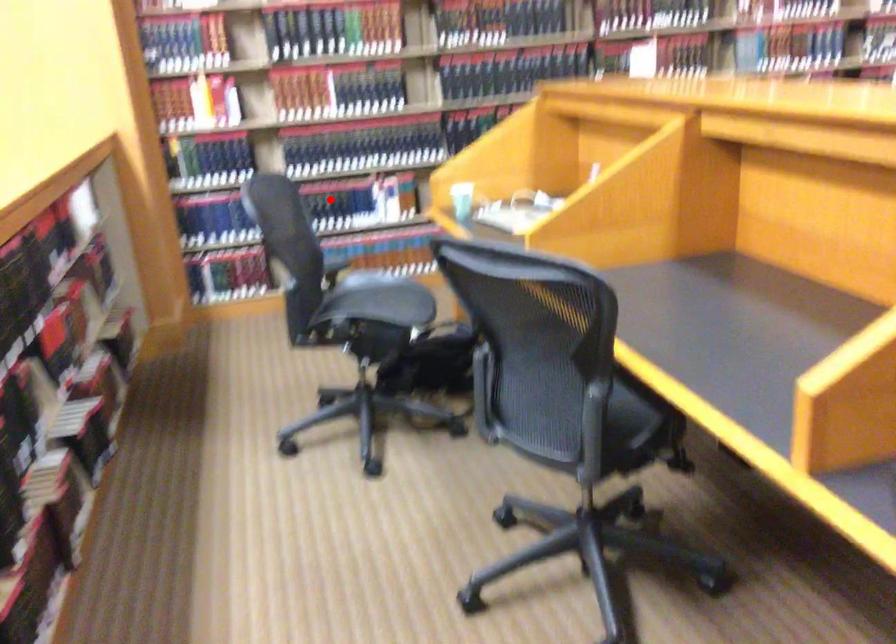
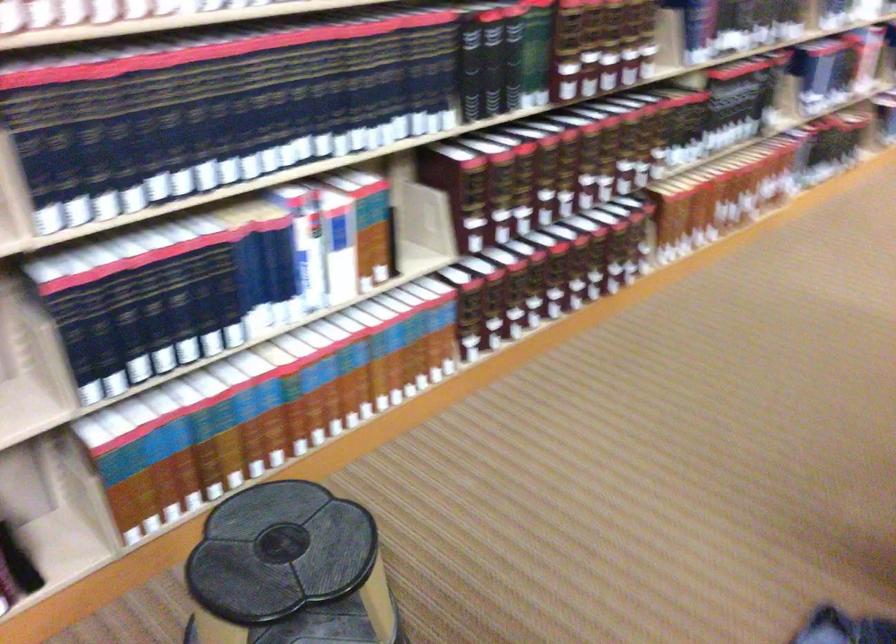
Question: A red point is marked in image1. In image2, is the corresponding 3D point closer to the camera or farther? Reply with the corresponding letter.

Choices:
 (A) The corresponding 3D point is closer.
 (B) The corresponding 3D point is farther.

Answer: (A)